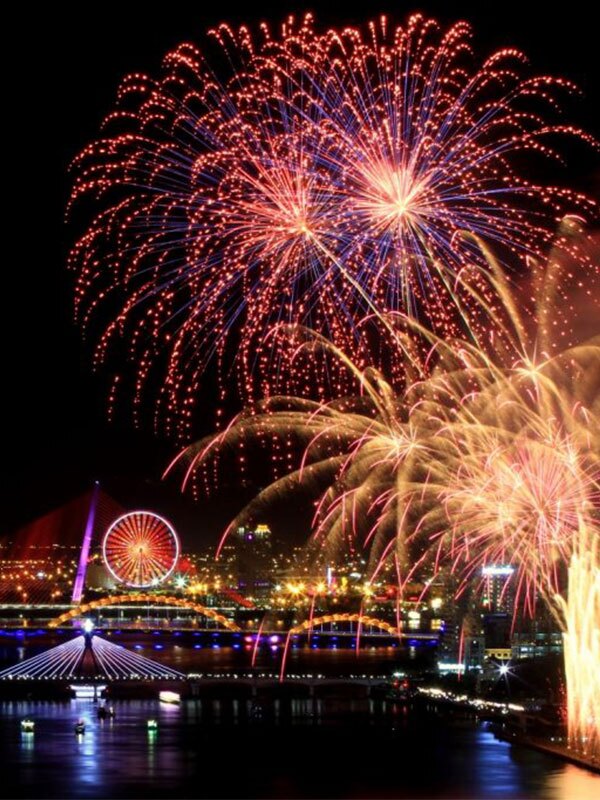
Locate an element on the screen. purple light is located at coordinates (86, 542).